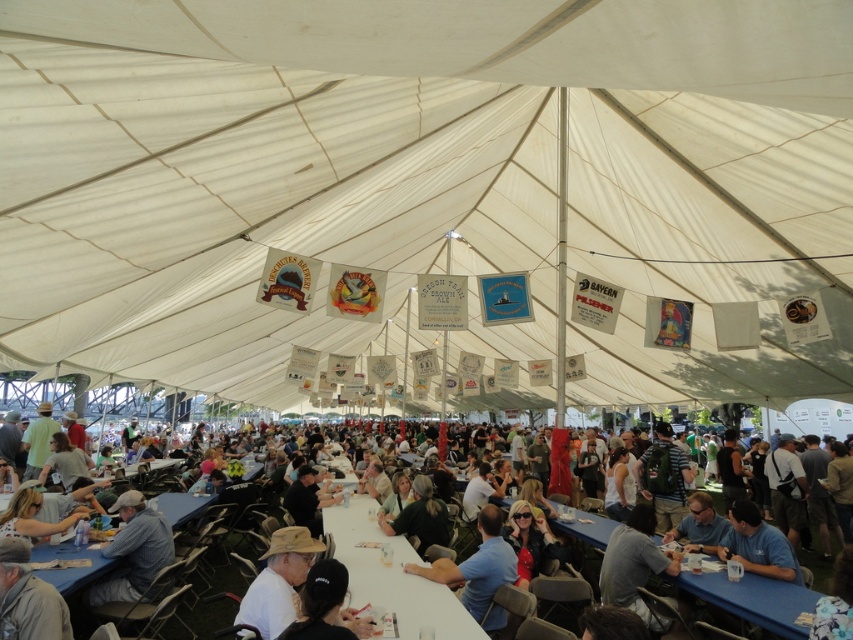
In the scene shown: You are a server carrying a tray of drinks and need to reach the light brown leather jacket at lower left from the white plastic table at center. Can you walk directly between them without needing to detour?

The distance between the white plastic table at center and the light brown leather jacket at lower left is 1.78 meters. Since 1.78 meters is a reasonable space for a person to walk through, you can walk directly between them without needing to detour.

You are a guest at the event and want to sit at the white plastic table at center. However, there is a light brown leather jacket at lower left. Can you sit there without moving the jacket?

The white plastic table at center is positioned under light brown leather jacket at lower left, meaning the jacket is hanging above the table. Since the jacket is above the table, you can sit there without moving it.

You are standing at the entrance of the tent and see the white fabric canopy at center. If you want to touch it, how many steps do you need to take forward?

The white fabric canopy at center is 1.96 meters from viewer, so you need to take approximately 2 steps forward to reach it.